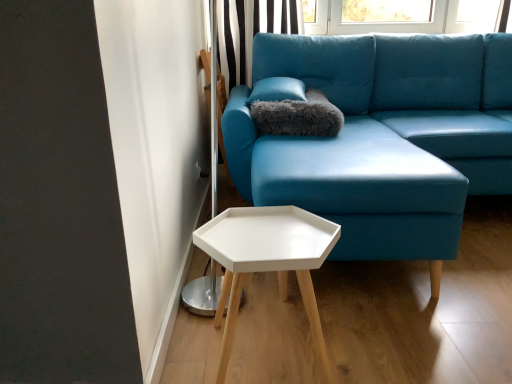
Question: From a real-world perspective, is gray fluffy pillow at upper center located higher than white matte hexagonal table at lower center?

Choices:
 (A) no
 (B) yes

Answer: (B)

Question: Can you confirm if gray fluffy pillow at upper center is smaller than white matte hexagonal table at lower center?

Choices:
 (A) yes
 (B) no

Answer: (A)

Question: Considering the relative sizes of gray fluffy pillow at upper center and white matte hexagonal table at lower center in the image provided, is gray fluffy pillow at upper center thinner than white matte hexagonal table at lower center?

Choices:
 (A) no
 (B) yes

Answer: (A)

Question: Is white matte hexagonal table at lower center at the back of gray fluffy pillow at upper center?

Choices:
 (A) no
 (B) yes

Answer: (A)

Question: From a real-world perspective, is gray fluffy pillow at upper center beneath white matte hexagonal table at lower center?

Choices:
 (A) yes
 (B) no

Answer: (B)

Question: Is black striped curtain at upper center to the left or to the right of white matte hexagonal table at lower center in the image?

Choices:
 (A) right
 (B) left

Answer: (B)

Question: From the image's perspective, relative to white matte hexagonal table at lower center, is black striped curtain at upper center above or below?

Choices:
 (A) below
 (B) above

Answer: (B)

Question: Relative to white matte hexagonal table at lower center, is black striped curtain at upper center in front or behind?

Choices:
 (A) front
 (B) behind

Answer: (B)

Question: Is black striped curtain at upper center bigger or smaller than white matte hexagonal table at lower center?

Choices:
 (A) small
 (B) big

Answer: (B)

Question: In the image, is matte blue fabric couch at center positioned in front of or behind white matte hexagonal table at lower center?

Choices:
 (A) behind
 (B) front

Answer: (A)

Question: Is matte blue fabric couch at center situated inside white matte hexagonal table at lower center or outside?

Choices:
 (A) inside
 (B) outside

Answer: (B)

Question: Is point (281, 79) positioned closer to the camera than point (227, 304)?

Choices:
 (A) closer
 (B) farther

Answer: (B)

Question: From the image's perspective, is matte blue fabric couch at center positioned above or below white matte hexagonal table at lower center?

Choices:
 (A) above
 (B) below

Answer: (A)

Question: From a real-world perspective, is white matte hexagonal table at lower center physically located above or below black striped curtain at upper center?

Choices:
 (A) below
 (B) above

Answer: (A)

Question: Is point (224, 337) positioned closer to the camera than point (247, 23)?

Choices:
 (A) farther
 (B) closer

Answer: (B)